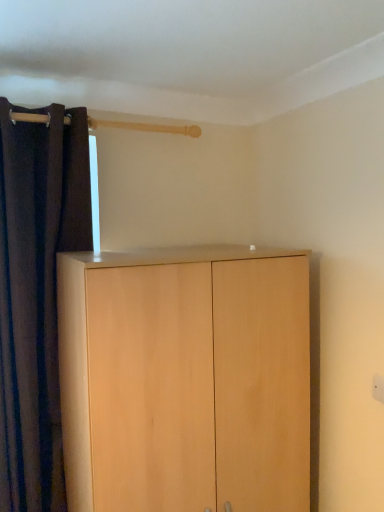
What do you see at coordinates (36, 293) in the screenshot? I see `dark fabric curtain at left` at bounding box center [36, 293].

You are a GUI agent. You are given a task and a screenshot of the screen. Output one action in this format:
    pyautogui.click(x=<x>, y=<y>)
    Task: Click on the dark fabric curtain at left
    
    Given the screenshot: What is the action you would take?
    pyautogui.click(x=36, y=293)

The width and height of the screenshot is (384, 512). What do you see at coordinates (185, 379) in the screenshot?
I see `light wood cupboard at center` at bounding box center [185, 379].

Where is `light wood cupboard at center`? Image resolution: width=384 pixels, height=512 pixels. light wood cupboard at center is located at coordinates (185, 379).

The image size is (384, 512). Find the location of `dark fabric curtain at left`. dark fabric curtain at left is located at coordinates (36, 293).

Considering the relative positions of dark fabric curtain at left and light wood cupboard at center in the image provided, is dark fabric curtain at left to the left of light wood cupboard at center from the viewer's perspective?

Correct, you'll find dark fabric curtain at left to the left of light wood cupboard at center.

Considering their positions, is dark fabric curtain at left located in front of or behind light wood cupboard at center?

dark fabric curtain at left is positioned farther from the viewer than light wood cupboard at center.

Which is in front, point (52, 346) or point (216, 463)?

Positioned in front is point (216, 463).

From the image's perspective, does dark fabric curtain at left appear higher than light wood cupboard at center?

Yes, from the image's perspective, dark fabric curtain at left is over light wood cupboard at center.

From a real-world perspective, is dark fabric curtain at left above or below light wood cupboard at center?

From a real-world perspective, dark fabric curtain at left is physically above light wood cupboard at center.

Which object is thinner, dark fabric curtain at left or light wood cupboard at center?

Thinner between the two is dark fabric curtain at left.

Considering the relative sizes of dark fabric curtain at left and light wood cupboard at center in the image provided, is dark fabric curtain at left shorter than light wood cupboard at center?

No.

Which of these two, dark fabric curtain at left or light wood cupboard at center, is bigger?

light wood cupboard at center is bigger.

Is dark fabric curtain at left surrounding light wood cupboard at center?

No, light wood cupboard at center is not inside dark fabric curtain at left.

Would you say dark fabric curtain at left is a long distance from light wood cupboard at center?

That's not correct — dark fabric curtain at left is a little close to light wood cupboard at center.

Is dark fabric curtain at left aimed at light wood cupboard at center?

No, dark fabric curtain at left does not turn towards light wood cupboard at center.

Measure the distance from dark fabric curtain at left to light wood cupboard at center.

dark fabric curtain at left is 21.59 inches from light wood cupboard at center.

The width and height of the screenshot is (384, 512). I want to click on cupboard that is under the dark fabric curtain at left (from a real-world perspective), so click(x=185, y=379).

Is light wood cupboard at center to the left of dark fabric curtain at left from the viewer's perspective?

No.

Based on the photo, is light wood cupboard at center in front of dark fabric curtain at left?

Yes, it is.

Which is closer to the camera, (207, 329) or (30, 291)?

Positioned in front is point (207, 329).

From the image's perspective, is light wood cupboard at center positioned above or below dark fabric curtain at left?

Based on their image positions, light wood cupboard at center is located beneath dark fabric curtain at left.

From a real-world perspective, is light wood cupboard at center over dark fabric curtain at left?

No, from a real-world perspective, light wood cupboard at center is not above dark fabric curtain at left.

Does light wood cupboard at center have a greater width compared to dark fabric curtain at left?

Yes.

Does light wood cupboard at center have a lesser height compared to dark fabric curtain at left?

Yes.

Is light wood cupboard at center bigger than dark fabric curtain at left?

Yes, light wood cupboard at center is bigger than dark fabric curtain at left.

Is light wood cupboard at center not within dark fabric curtain at left?

light wood cupboard at center is positioned outside dark fabric curtain at left.

Is light wood cupboard at center touching dark fabric curtain at left?

No, light wood cupboard at center is not in contact with dark fabric curtain at left.

Is light wood cupboard at center facing towards dark fabric curtain at left?

No, light wood cupboard at center is not aimed at dark fabric curtain at left.

How different are the orientations of light wood cupboard at center and dark fabric curtain at left in degrees?

light wood cupboard at center and dark fabric curtain at left are facing 0.367 degrees away from each other.

In order to click on cupboard that is below the dark fabric curtain at left (from the image's perspective) in this screenshot , I will do `click(185, 379)`.

This screenshot has height=512, width=384. I want to click on curtain lying above the light wood cupboard at center (from the image's perspective), so click(36, 293).

Where is `curtain above the light wood cupboard at center (from a real-world perspective)`? Image resolution: width=384 pixels, height=512 pixels. curtain above the light wood cupboard at center (from a real-world perspective) is located at coordinates (36, 293).